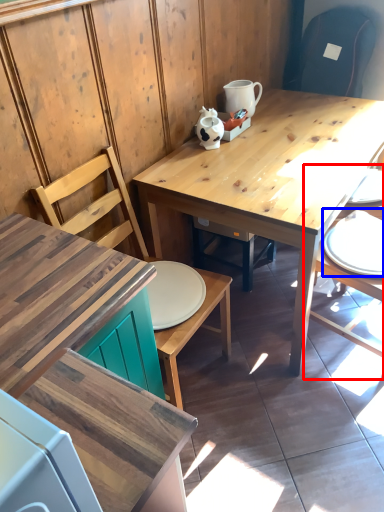
Question: Among these objects, which one is farthest to the camera, chair (highlighted by a red box) or tableware (highlighted by a blue box)?

Choices:
 (A) chair
 (B) tableware

Answer: (B)